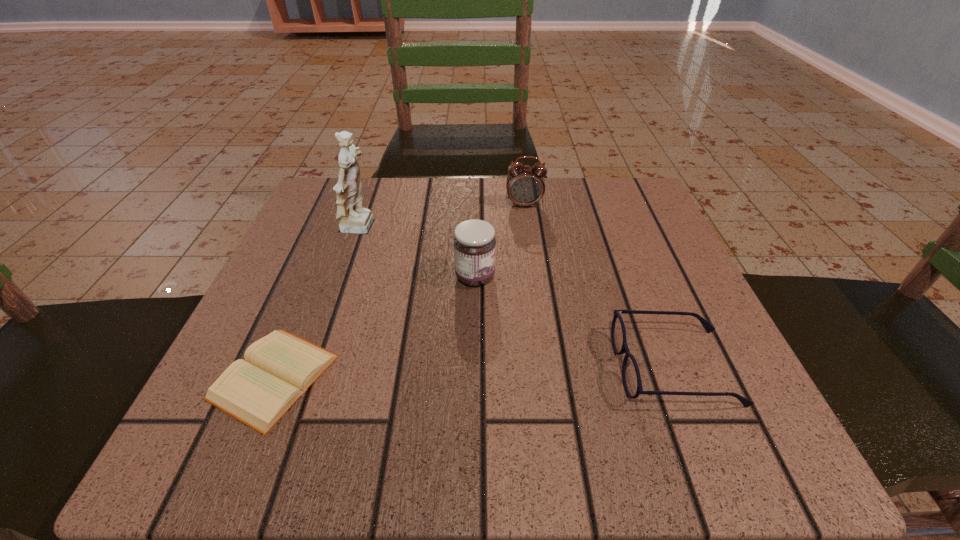
I want to click on the tallest object, so click(353, 218).

Locate an element on the screen. This screenshot has width=960, height=540. the fourth nearest object is located at coordinates (353, 218).

Where is `the farthest object`? This screenshot has height=540, width=960. the farthest object is located at coordinates (525, 185).

Locate an element on the screen. Image resolution: width=960 pixels, height=540 pixels. the fourth object from left to right is located at coordinates (525, 185).

Find the location of a particular element. Image resolution: width=960 pixels, height=540 pixels. the third farthest object is located at coordinates (474, 243).

Where is `the third object from right to left`? The image size is (960, 540). the third object from right to left is located at coordinates (474, 243).

Locate an element on the screen. This screenshot has height=540, width=960. spectacles is located at coordinates (631, 378).

Find the location of a particular element. the second shortest object is located at coordinates (631, 378).

The image size is (960, 540). I want to click on diary, so click(x=279, y=368).

Identify the location of vacant space located 0.210m on the front-facing side of the tallest object. This screenshot has width=960, height=540. (486, 229).